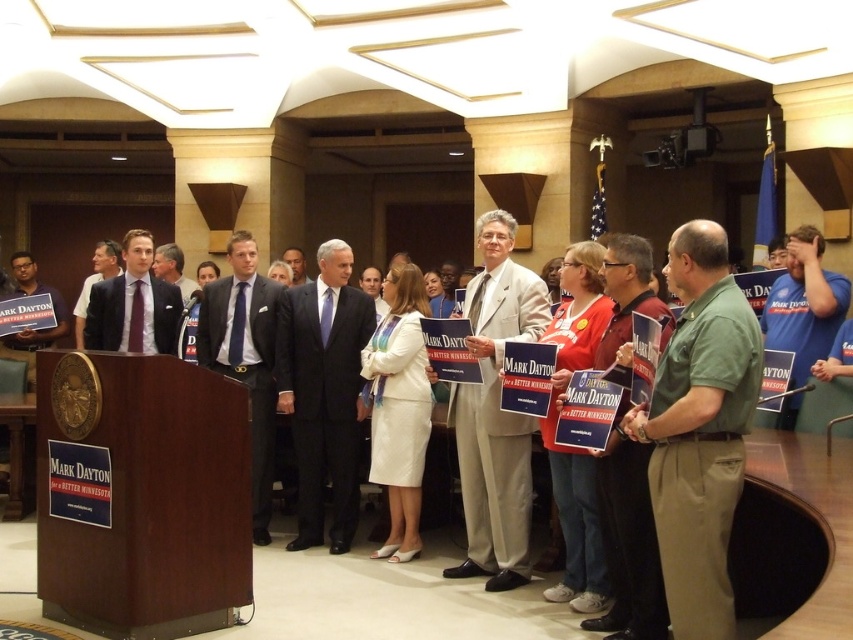
Question: Does khaki cotton shirt at center appear on the left side of light brown suit at center?

Choices:
 (A) yes
 (B) no

Answer: (B)

Question: Among these objects, which one is farthest from the camera?

Choices:
 (A) matte black suit at center
 (B) khaki cotton shirt at center
 (C) matte purple tie at left

Answer: (C)

Question: Which object appears farthest from the camera in this image?

Choices:
 (A) light beige suit at center
 (B) dark gray suit at center
 (C) matte black suit at left

Answer: (C)

Question: Can you confirm if light beige suit at center is positioned to the right of light brown suit at center?

Choices:
 (A) no
 (B) yes

Answer: (B)

Question: Based on their relative distances, which object is nearer to the dark blue suit at center?

Choices:
 (A) matte purple tie at left
 (B) light beige suit at center
 (C) green fabric shirt at center

Answer: (A)

Question: Does khaki cotton shirt at center come in front of dark gray suit at center?

Choices:
 (A) no
 (B) yes

Answer: (B)